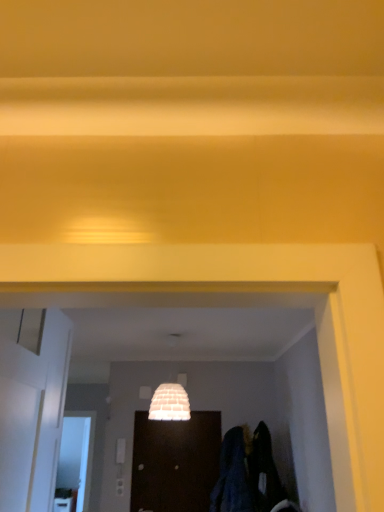
I want to click on dark wood door at center, the first door from the back, so click(x=175, y=462).

What are the coordinates of `white glossy door at left, the second door when ordered from right to left` in the screenshot? It's located at (33, 416).

At what (x,y) coordinates should I click in order to perform the action: click on dark blue fabric at lower right. Please return your answer as a coordinate pair (x, y). Looking at the image, I should click on (247, 473).

Locate an element on the screen. The height and width of the screenshot is (512, 384). dark wood door at center, the first door from the back is located at coordinates (175, 462).

From a real-world perspective, is white glossy door at left, the second door when ordered from right to left, below dark blue fabric at lower right?

No, from a real-world perspective, white glossy door at left, the second door when ordered from right to left, is not below dark blue fabric at lower right.

From the image's perspective, which one is positioned lower, white glossy door at left, which ranks as the second door in back-to-front order, or dark blue fabric at lower right?

dark blue fabric at lower right is shown below in the image.

Based on the photo, is white glossy door at left, the first door from the left, at the right side of dark blue fabric at lower right?

No.

Image resolution: width=384 pixels, height=512 pixels. In order to click on door in front of the dark blue fabric at lower right in this screenshot , I will do `click(33, 416)`.

Looking at this image, is white glossy door at left, placed as the 1th door when sorted from top to bottom, to the left of white textured lampshade at center from the viewer's perspective?

Indeed, white glossy door at left, placed as the 1th door when sorted from top to bottom, is positioned on the left side of white textured lampshade at center.

Considering the relative sizes of white glossy door at left, the first door from the left, and white textured lampshade at center in the image provided, is white glossy door at left, the first door from the left, wider than white textured lampshade at center?

Incorrect, the width of white glossy door at left, the first door from the left, does not surpass that of white textured lampshade at center.

Is white textured lampshade at center completely or partially inside white glossy door at left, the first door from the left?

Actually, white textured lampshade at center is outside white glossy door at left, the first door from the left.

From the image's perspective, is white textured lampshade at center on white glossy door at left, the 1th door when ordered from front to back?

No, from the image's perspective, white textured lampshade at center is not over white glossy door at left, the 1th door when ordered from front to back.

Is white textured lampshade at center shorter than white glossy door at left, the first door from the left?

Correct, white textured lampshade at center is not as tall as white glossy door at left, the first door from the left.

Do you think white textured lampshade at center is within white glossy door at left, placed as the 1th door when sorted from top to bottom, or outside of it?

white textured lampshade at center lies outside white glossy door at left, placed as the 1th door when sorted from top to bottom.

Considering the sizes of white glossy door at left, acting as the 2th door starting from the bottom, and dark wood door at center, the first door positioned from the right, in the image, is white glossy door at left, acting as the 2th door starting from the bottom, wider or thinner than dark wood door at center, the first door positioned from the right,?

In the image, white glossy door at left, acting as the 2th door starting from the bottom, appears to be wider than dark wood door at center, the first door positioned from the right.

From the image's perspective, is white glossy door at left, the first door from the left, located above dark wood door at center, the first door positioned from the right?

Yes, from the image's perspective, white glossy door at left, the first door from the left, is above dark wood door at center, the first door positioned from the right.

In the scene shown: How far apart are white glossy door at left, the first door from the left, and dark wood door at center, the first door from the back?

white glossy door at left, the first door from the left, and dark wood door at center, the first door from the back, are 2.52 meters apart from each other.

Is point (56, 445) positioned behind point (210, 443)?

No.

Is white textured lampshade at center taller than dark wood door at center, marked as the 1th door in a bottom-to-top arrangement?

No, white textured lampshade at center is not taller than dark wood door at center, marked as the 1th door in a bottom-to-top arrangement.

From a real-world perspective, which object stands above the other?

white textured lampshade at center.

Which is correct: white textured lampshade at center is inside dark wood door at center, marked as the 2th door in a left-to-right arrangement, or outside of it?

white textured lampshade at center exists outside the volume of dark wood door at center, marked as the 2th door in a left-to-right arrangement.

From the picture: Is white textured lampshade at center facing away from dark wood door at center, the first door from the back?

No.

From a real-world perspective, is dark blue fabric at lower right above or below white glossy door at left, the first door from the left?

dark blue fabric at lower right is situated lower than white glossy door at left, the first door from the left, in the real world.

Between dark blue fabric at lower right and white glossy door at left, placed as the 1th door when sorted from top to bottom, which one has more height?

white glossy door at left, placed as the 1th door when sorted from top to bottom, is taller.

Is point (231, 463) farther from camera compared to point (33, 386)?

That is True.

Considering the positions of objects dark wood door at center, marked as the 2th door in a left-to-right arrangement, and white glossy door at left, which ranks as the second door in back-to-front order, in the image provided, who is more to the left, dark wood door at center, marked as the 2th door in a left-to-right arrangement, or white glossy door at left, which ranks as the second door in back-to-front order,?

From the viewer's perspective, white glossy door at left, which ranks as the second door in back-to-front order, appears more on the left side.

Find the location of a particular element. The image size is (384, 512). door below the white glossy door at left, the 1th door when ordered from front to back (from a real-world perspective) is located at coordinates (175, 462).

From a real-world perspective, which is physically above, dark wood door at center, marked as the 1th door in a bottom-to-top arrangement, or white glossy door at left, acting as the 2th door starting from the bottom?

white glossy door at left, acting as the 2th door starting from the bottom.

Considering their positions, is dark wood door at center, the 2th door in the top-to-bottom sequence, located in front of or behind white glossy door at left, acting as the 2th door starting from the bottom?

Clearly, dark wood door at center, the 2th door in the top-to-bottom sequence, is behind white glossy door at left, acting as the 2th door starting from the bottom.

From a real-world perspective, count 2nd doors upward from the dark blue fabric at lower right and point to it. Please provide its 2D coordinates.

[(33, 416)]

At what (x,y) coordinates should I click in order to perform the action: click on lamp behind the white glossy door at left, the second door when ordered from right to left. Please return your answer as a coordinate pair (x, y). The width and height of the screenshot is (384, 512). Looking at the image, I should click on (170, 403).

Estimate the real-world distances between objects in this image. Which object is closer to white glossy door at left, the 1th door when ordered from front to back, dark wood door at center, marked as the 1th door in a bottom-to-top arrangement, or dark blue fabric at lower right?

dark blue fabric at lower right.

Estimate the real-world distances between objects in this image. Which object is further from dark blue fabric at lower right, white textured lampshade at center or dark wood door at center, the first door from the back?

white textured lampshade at center.

When comparing their distances from white textured lampshade at center, does dark wood door at center, marked as the 1th door in a bottom-to-top arrangement, or white glossy door at left, the first door from the left, seem further?

Based on the image, white glossy door at left, the first door from the left, appears to be further to white textured lampshade at center.

Which object lies further to the anchor point dark blue fabric at lower right, white textured lampshade at center or white glossy door at left, which ranks as the second door in back-to-front order?

The object further to dark blue fabric at lower right is white glossy door at left, which ranks as the second door in back-to-front order.

When comparing their distances from white glossy door at left, the first door from the left, does dark wood door at center, the first door positioned from the right, or white textured lampshade at center seem closer?

white textured lampshade at center is closer to white glossy door at left, the first door from the left.

Estimate the real-world distances between objects in this image. Which object is further from dark wood door at center, marked as the 2th door in a left-to-right arrangement, dark blue fabric at lower right or white glossy door at left, the first door from the left?

white glossy door at left, the first door from the left, is further to dark wood door at center, marked as the 2th door in a left-to-right arrangement.

Based on their spatial positions, is white glossy door at left, acting as the 2th door starting from the bottom, or dark wood door at center, marked as the 2th door in a left-to-right arrangement, closer to dark blue fabric at lower right?

dark wood door at center, marked as the 2th door in a left-to-right arrangement, is closer to dark blue fabric at lower right.

Considering their positions, is dark blue fabric at lower right positioned further to dark wood door at center, marked as the 2th door in a left-to-right arrangement, than white textured lampshade at center?

white textured lampshade at center.

The height and width of the screenshot is (512, 384). I want to click on laundry between white textured lampshade at center and dark wood door at center, acting as the second door starting from the front, in the up-down direction, so click(x=247, y=473).

Identify the location of lamp located between white glossy door at left, the second door when ordered from right to left, and dark blue fabric at lower right in the depth direction. (170, 403).

The height and width of the screenshot is (512, 384). I want to click on lamp between white glossy door at left, placed as the 1th door when sorted from top to bottom, and dark wood door at center, acting as the second door starting from the front, in the front-back direction, so click(x=170, y=403).

Identify the location of laundry between white glossy door at left, the second door when ordered from right to left, and dark wood door at center, the first door positioned from the right, in the front-back direction. This screenshot has width=384, height=512. (247, 473).